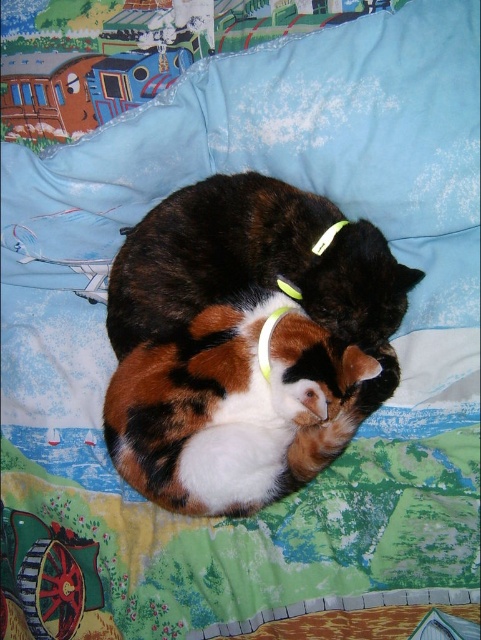
You are designing a new pet bed and want to ensure it accommodates both the neon yellow fabric at center and the yellow fabric neckband at center. Based on the image, which of these two items is wider?

The neon yellow fabric at center is wider than the yellow fabric neckband at center according to the description.

You are a photographer trying to capture the calico fur cat at center and the neon yellow fabric at center in the image. Based on their positions, which object is closer to the camera?

The calico fur cat at center is below the neon yellow fabric at center, so the neon yellow fabric at center is closer to the camera.